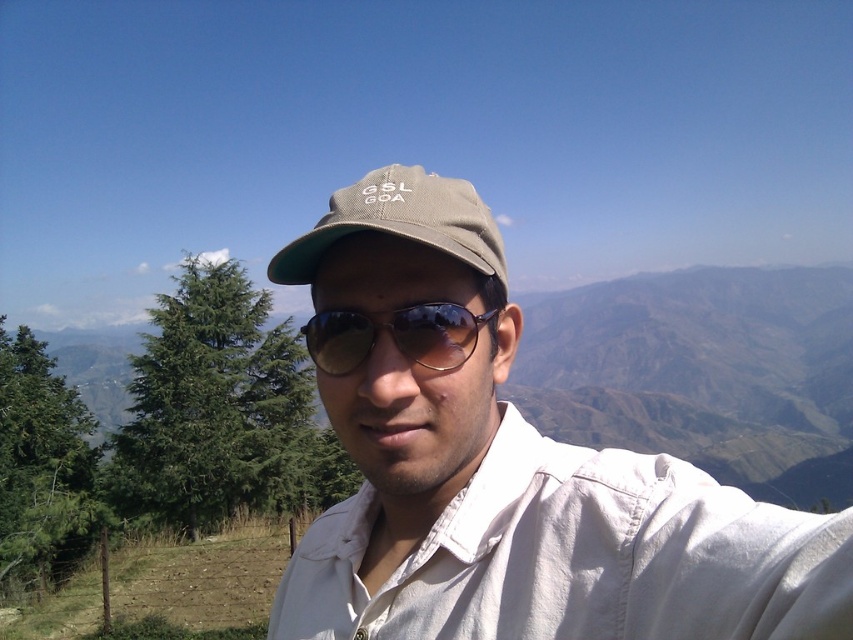
You are a photographer trying to capture the perfect selfie. You have a matte khaki cap at center and sunglasses at center. Which object is larger in the photo?

The matte khaki cap at center is bigger than the sunglasses at center, so the matte khaki cap at center is larger in the photo.

You are a photographer trying to capture the perfect shot of the person in the scene. You need to ensure both the matte khaki cap at center and the khaki fabric cap at center are in focus. Given that your camera can only focus on objects within a 2 meter range, will both caps be in focus?

The matte khaki cap at center is 2.12 meters from khaki fabric cap at center, which exceeds the 2 meter range. Therefore, both caps cannot be in focus simultaneously.

From the picture: You are a photographer trying to frame a shot of the scene described. The subject is wearing a matte khaki cap at center. To ensure the cap is centered in your 4K camera viewfinder, which has a resolution of 3840x2160 pixels, what pixel coordinates should you aim for?

The matte khaki cap at center is located at point (506, 467) in 2D coordinates. To convert this to pixel coordinates on a 4K camera with 3840x2160 resolution, multiply each coordinate by the respective dimension. The x coordinate is 0.731 multiplied by 3840, resulting in approximately 2808 pixels. The y coordinate is 0.594 multiplied by 2160, giving approximately 1282 pixels. Therefore, the pixel coordinates are approximately (852, 639).